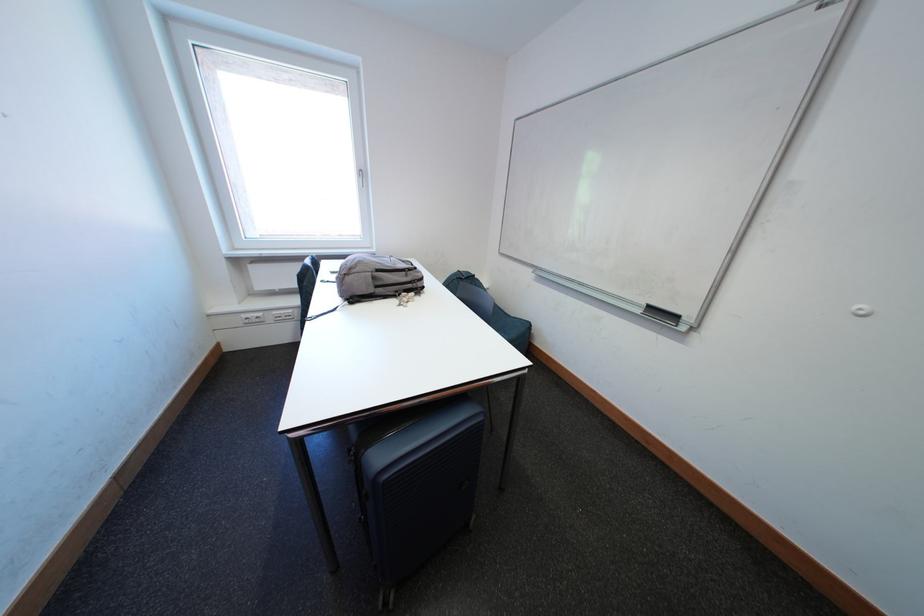
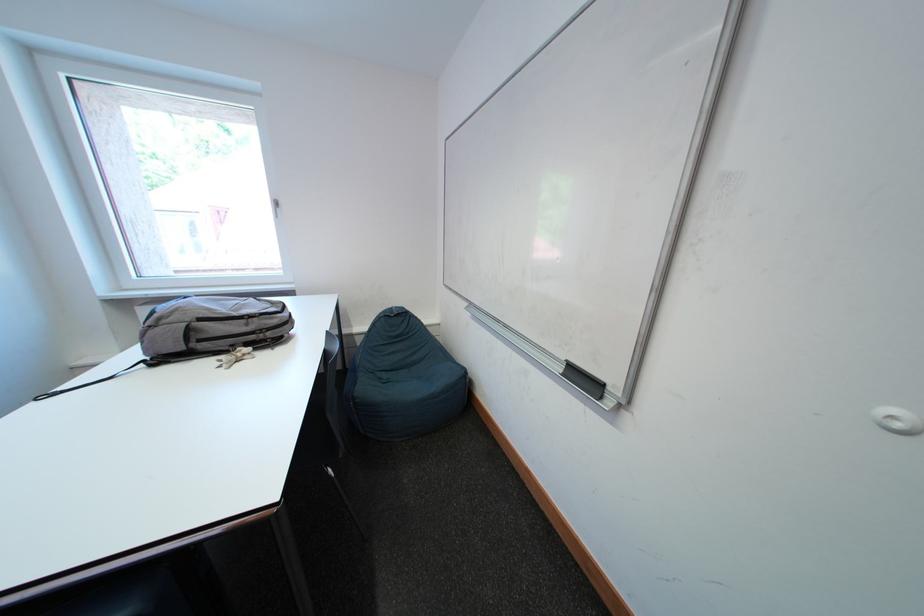
Find the pixel in the second image that matches (406,294) in the first image.

(241, 349)